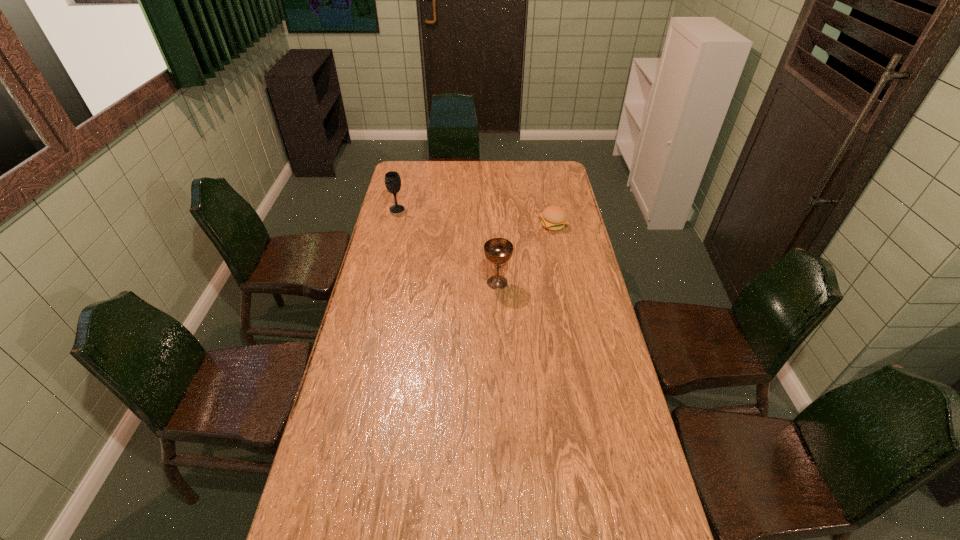
Locate an element on the screen. The image size is (960, 540). object that stands as the second closest to the nearest object is located at coordinates (392, 179).

Identify which object is located as the nearest to the chalice. Please provide its 2D coordinates. Your answer should be formatted as a tuple, i.e. [(x, y)], where the tuple contains the x and y coordinates of a point satisfying the conditions above.

[(554, 218)]

Find the location of `free space that satisfies the following two spatial constraints: 1. on the back side of the hamburger; 2. on the left side of the second object from left to right`. free space that satisfies the following two spatial constraints: 1. on the back side of the hamburger; 2. on the left side of the second object from left to right is located at coordinates (495, 225).

Find the location of `free space that satisfies the following two spatial constraints: 1. on the front side of the wineglass; 2. on the left side of the second nearest object`. free space that satisfies the following two spatial constraints: 1. on the front side of the wineglass; 2. on the left side of the second nearest object is located at coordinates (393, 225).